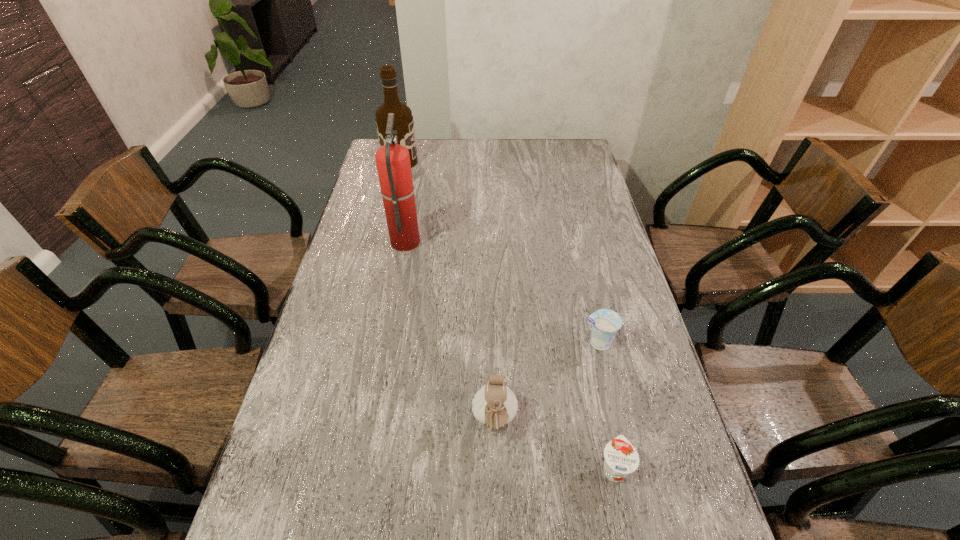
What are the coordinates of `vacant space at the far right corner` in the screenshot? It's located at (577, 140).

Image resolution: width=960 pixels, height=540 pixels. I want to click on free space between the second farthest object and the nearest object, so click(x=510, y=355).

This screenshot has height=540, width=960. I want to click on free space between the fourth farthest object and the shorter yogurt, so [x=554, y=445].

I want to click on free area in between the third object from left to right and the second farthest object, so click(450, 331).

You are a GUI agent. You are given a task and a screenshot of the screen. Output one action in this format:
    pyautogui.click(x=<x>, y=<y>)
    Task: Click on the blank region between the alcohol and the pouch
    
    Given the screenshot: What is the action you would take?
    pyautogui.click(x=447, y=292)

Find the location of a particular element. This screenshot has height=540, width=960. free space that is in between the alcohol and the shortest object is located at coordinates (507, 315).

Identify the location of free area in between the taller yogurt and the pouch. This screenshot has height=540, width=960. (546, 382).

Identify the location of free space between the fourth farthest object and the third farthest object. The height and width of the screenshot is (540, 960). (546, 382).

Where is `vacant area that lies between the fourth nearest object and the nearer yogurt`? This screenshot has width=960, height=540. vacant area that lies between the fourth nearest object and the nearer yogurt is located at coordinates (510, 355).

Select which object appears as the third closest to the farthest object. Please provide its 2D coordinates. Your answer should be formatted as a tuple, i.e. [(x, y)], where the tuple contains the x and y coordinates of a point satisfying the conditions above.

[(495, 405)]